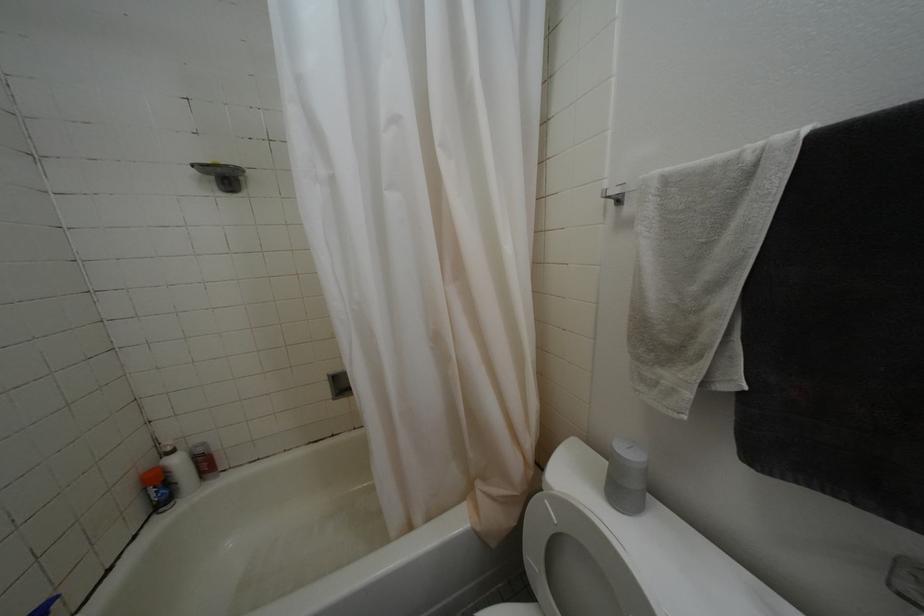
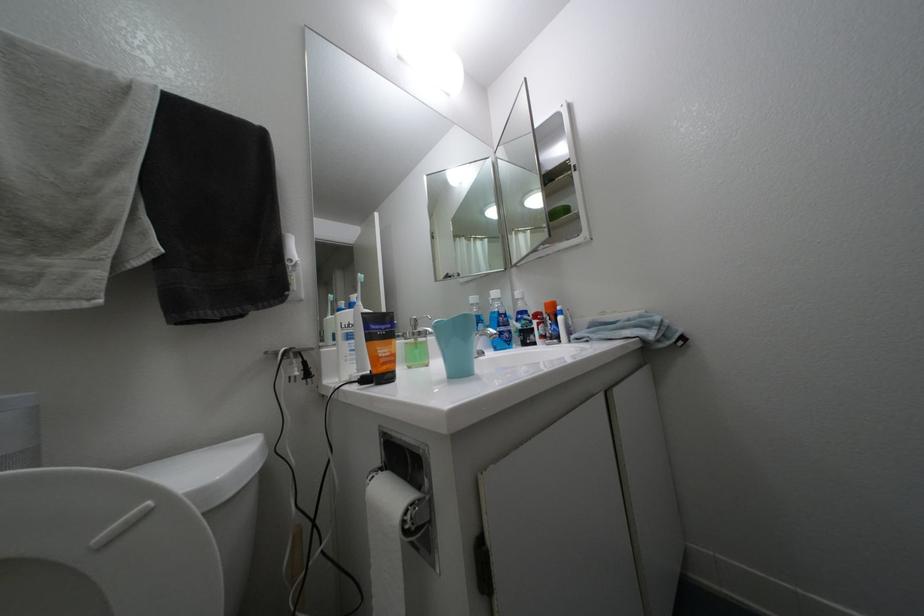
Question: The camera is either moving clockwise (left) or counter-clockwise (right) around the object. The first image is from the beginning of the video and the second image is from the end. Is the camera moving left or right when shooting the video?

Choices:
 (A) Left
 (B) Right

Answer: (A)